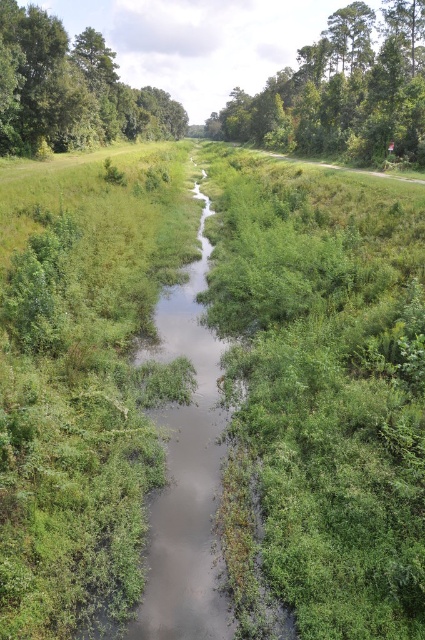
Question: Can you confirm if green leafy tree at upper center is positioned above green leafy tree at upper left?

Choices:
 (A) no
 (B) yes

Answer: (B)

Question: From the image, what is the correct spatial relationship of green leafy tree at upper center in relation to green leafy tree at upper left?

Choices:
 (A) above
 (B) below

Answer: (A)

Question: Which point is closer to the camera?

Choices:
 (A) green leafy tree at upper left
 (B) green leafy tree at upper center

Answer: (B)

Question: Is green leafy tree at upper center smaller than green leafy tree at upper left?

Choices:
 (A) no
 (B) yes

Answer: (A)